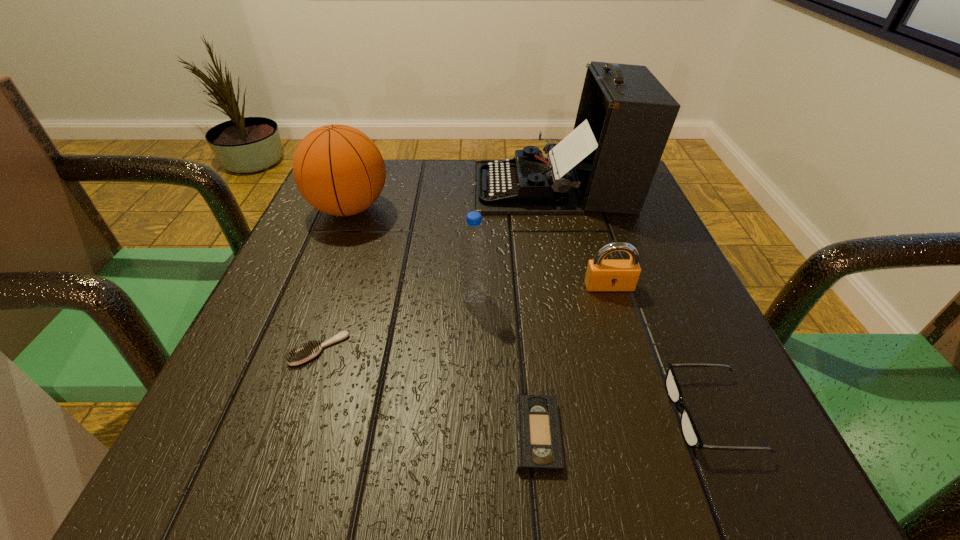
Locate an element on the screen. This screenshot has width=960, height=540. free space located inside the open case of the typewriter is located at coordinates (391, 187).

Where is `vacant area located 0.180m on the right of the basketball`? The height and width of the screenshot is (540, 960). vacant area located 0.180m on the right of the basketball is located at coordinates (474, 208).

You are a GUI agent. You are given a task and a screenshot of the screen. Output one action in this format:
    pyautogui.click(x=<x>, y=<y>)
    Task: Click on the vacant space located on the right of the water bottle
    This screenshot has width=960, height=540.
    Given the screenshot: What is the action you would take?
    pyautogui.click(x=547, y=298)

At what (x,y) coordinates should I click in order to perform the action: click on vacant space located to unlock the padlock from the front. Please return your answer as a coordinate pair (x, y). The image size is (960, 540). Looking at the image, I should click on (670, 480).

Image resolution: width=960 pixels, height=540 pixels. Identify the location of free space located on the front-facing side of the fifth tallest object. (410, 414).

Find the location of a particular element. free space located on the front-facing side of the fifth tallest object is located at coordinates (516, 414).

This screenshot has width=960, height=540. What are the coordinates of `vacant space located on the front-facing side of the fifth tallest object` in the screenshot? It's located at [x=516, y=414].

At what (x,y) coordinates should I click in order to perform the action: click on free space located 0.060m on the back of the second shortest object. Please return your answer as a coordinate pair (x, y). Looking at the image, I should click on (334, 306).

Where is `vacant space located on the left of the shortest object`? This screenshot has width=960, height=540. vacant space located on the left of the shortest object is located at coordinates (249, 434).

I want to click on typewriter at the far edge, so click(607, 163).